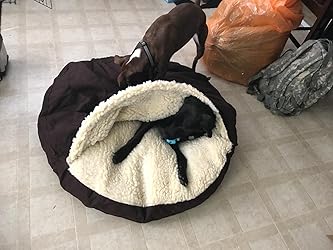
Locate an element on the screen. gray patterned floor is located at coordinates (272, 188).